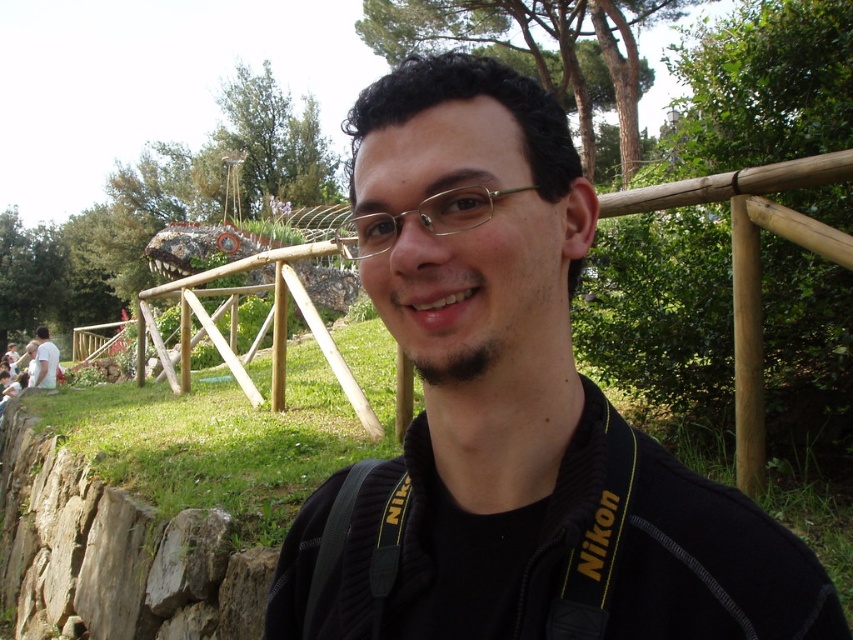
You are a photographer trying to capture a clear shot of the gold metallic glasses at center and the white cotton shirt at lower left. Since you want both objects in focus, you need to know their relative sizes. Which object is smaller?

The gold metallic glasses at center has a smaller size compared to the white cotton shirt at lower left.

You are a fashion designer observing a person in a park. You notice the black matte jacket at center and the white cotton shirt at lower left. Which clothing item appears narrower in width?

The black matte jacket at center has a lesser width compared to the white cotton shirt at lower left, so the black matte jacket at center appears narrower in width.

You are a fashion designer observing a person in a park. You notice the black matte jacket at center and the white cotton shirt at lower left. Which clothing item is covering part of the other?

The black matte jacket at center is positioned over the white cotton shirt at lower left, so it is covering part of it.